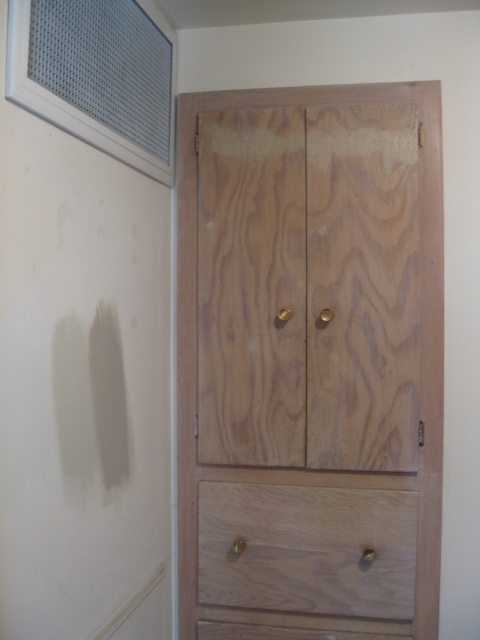
You are standing in the room and want to reach both the natural wood dresser at center and the natural wood drawer at lower center. Which one do you need to move towards first to reach the one that is closer to you?

The natural wood dresser at center is closer to the viewer than the natural wood drawer at lower center, so you should move towards the natural wood dresser at center first since it is already closer to you.

You are trying to decide where to place a tall plant that needs to fit between the natural wood dresser at center and the natural wood drawer at lower center. Based on their heights, which one should the plant be placed next to to ensure it doesn

The natural wood dresser at center is much taller than the natural wood drawer at lower center, so placing the tall plant next to the natural wood dresser at center would provide enough space for the plant to grow without obstruction.